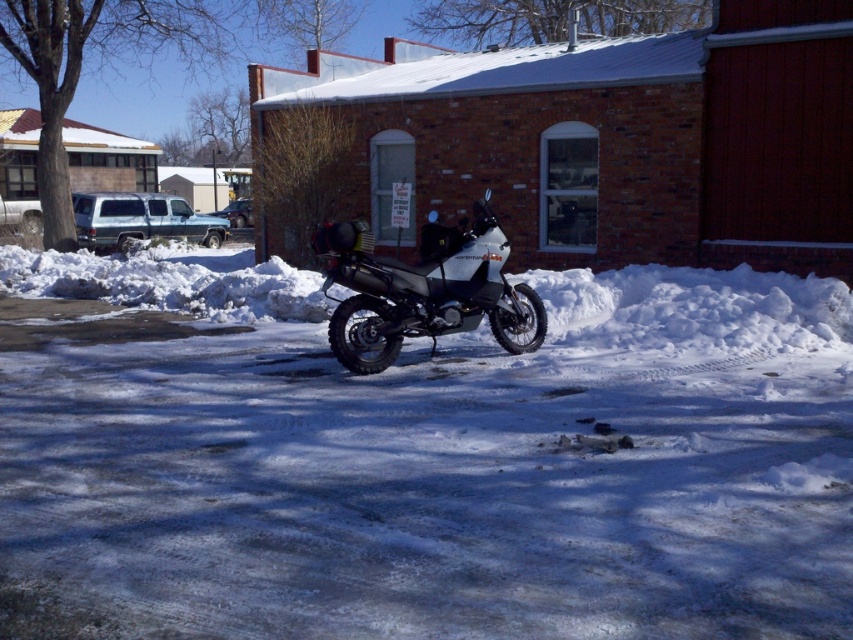
Question: Does white powdery snow at center appear on the right side of white matte adventure motorcycle at center?

Choices:
 (A) no
 (B) yes

Answer: (A)

Question: Which point is closer to the camera?

Choices:
 (A) (117, 515)
 (B) (534, 300)

Answer: (A)

Question: Can you confirm if white powdery snow at center is positioned above white matte adventure motorcycle at center?

Choices:
 (A) no
 (B) yes

Answer: (A)

Question: Among these objects, which one is farthest from the camera?

Choices:
 (A) white powdery snow at center
 (B) white matte adventure motorcycle at center

Answer: (B)

Question: Can you confirm if white powdery snow at center is positioned below white matte adventure motorcycle at center?

Choices:
 (A) no
 (B) yes

Answer: (B)